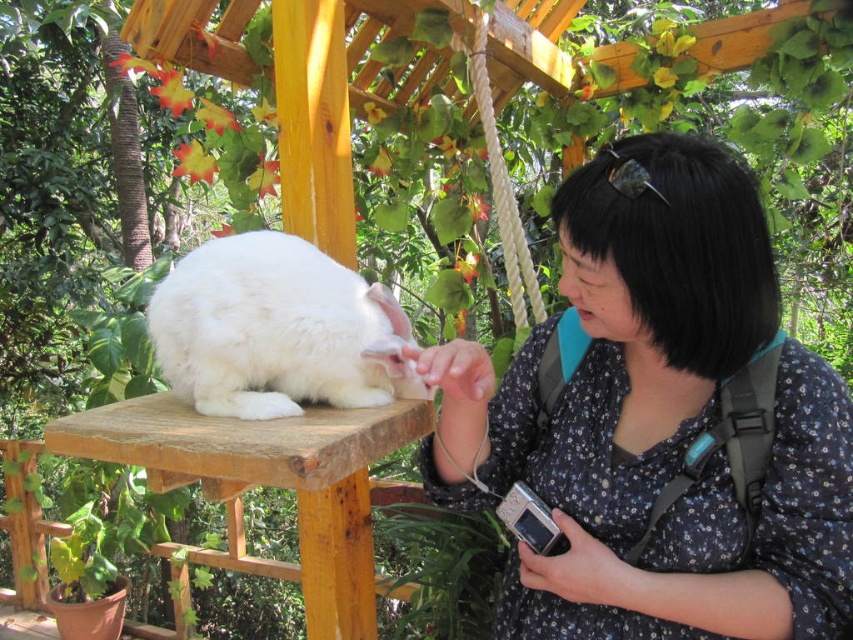
Question: From the image, what is the correct spatial relationship of floral print blouse at center in relation to white fluffy rabbit at center?

Choices:
 (A) below
 (B) above

Answer: (A)

Question: Which point is farther from the camera taking this photo?

Choices:
 (A) (782, 612)
 (B) (172, 424)

Answer: (B)

Question: Where is floral print blouse at center located in relation to wooden stool at center in the image?

Choices:
 (A) above
 (B) below

Answer: (A)

Question: Which point is farther from the camera taking this photo?

Choices:
 (A) (257, 266)
 (B) (310, 520)

Answer: (B)

Question: Considering the real-world distances, which object is farthest from the wooden stool at center?

Choices:
 (A) floral print blouse at center
 (B) white fluffy rabbit at center

Answer: (A)

Question: Is the position of white fluffy rabbit at center less distant than that of wooden stool at center?

Choices:
 (A) yes
 (B) no

Answer: (B)